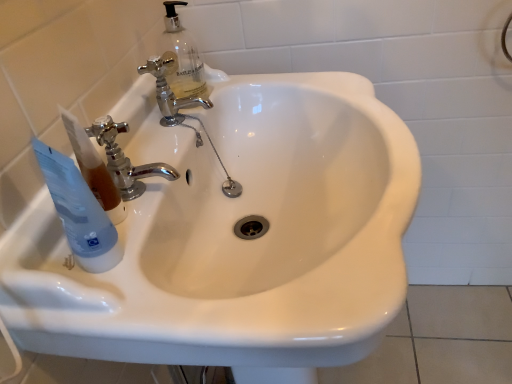
Question: Is white glossy sink at center a part of chrome metallic faucet at center, the 2th tap from the front?

Choices:
 (A) no
 (B) yes

Answer: (A)

Question: Is chrome metallic faucet at center, the second tap in the bottom-to-top sequence, wider than white glossy sink at center?

Choices:
 (A) yes
 (B) no

Answer: (B)

Question: From the image's perspective, is chrome metallic faucet at center, the first tap from the top, located beneath white glossy sink at center?

Choices:
 (A) no
 (B) yes

Answer: (A)

Question: Is chrome metallic faucet at center, which ranks as the 1th tap in back-to-front order, directly adjacent to white glossy sink at center?

Choices:
 (A) no
 (B) yes

Answer: (A)

Question: Considering the relative sizes of chrome metallic faucet at center, which ranks as the 1th tap in back-to-front order, and white glossy sink at center in the image provided, is chrome metallic faucet at center, which ranks as the 1th tap in back-to-front order, taller than white glossy sink at center?

Choices:
 (A) no
 (B) yes

Answer: (A)

Question: In terms of size, does chrome metallic faucet at upper left, the second tap positioned from the top, appear bigger or smaller than white glossy sink at center?

Choices:
 (A) small
 (B) big

Answer: (A)

Question: Is chrome metallic faucet at upper left, arranged as the second tap when viewed from the back, wider or thinner than white glossy sink at center?

Choices:
 (A) wide
 (B) thin

Answer: (B)

Question: Considering the positions of chrome metallic faucet at upper left, arranged as the 1th tap when viewed from the front, and white glossy sink at center in the image, is chrome metallic faucet at upper left, arranged as the 1th tap when viewed from the front, taller or shorter than white glossy sink at center?

Choices:
 (A) short
 (B) tall

Answer: (A)

Question: Does point (114, 142) appear closer or farther from the camera than point (309, 223)?

Choices:
 (A) farther
 (B) closer

Answer: (B)

Question: Is transparent plastic tube at left inside the boundaries of chrome metallic faucet at upper left, arranged as the 1th tap when viewed from the front, or outside?

Choices:
 (A) inside
 (B) outside

Answer: (B)

Question: From a real-world perspective, is transparent plastic tube at left above or below chrome metallic faucet at upper left, which is the 1th tap from bottom to top?

Choices:
 (A) below
 (B) above

Answer: (B)

Question: In the image, is transparent plastic tube at left positioned in front of or behind chrome metallic faucet at upper left, arranged as the 1th tap when viewed from the front?

Choices:
 (A) front
 (B) behind

Answer: (A)

Question: Looking at the image, does transparent plastic tube at left seem bigger or smaller compared to chrome metallic faucet at upper left, which is the 1th tap from bottom to top?

Choices:
 (A) big
 (B) small

Answer: (A)

Question: From the image's perspective, is transparent plastic tube at left above or below chrome metallic faucet at center, which ranks as the 1th tap in back-to-front order?

Choices:
 (A) above
 (B) below

Answer: (B)

Question: In terms of size, does transparent plastic tube at left appear bigger or smaller than chrome metallic faucet at center, the 2th tap from the front?

Choices:
 (A) small
 (B) big

Answer: (B)